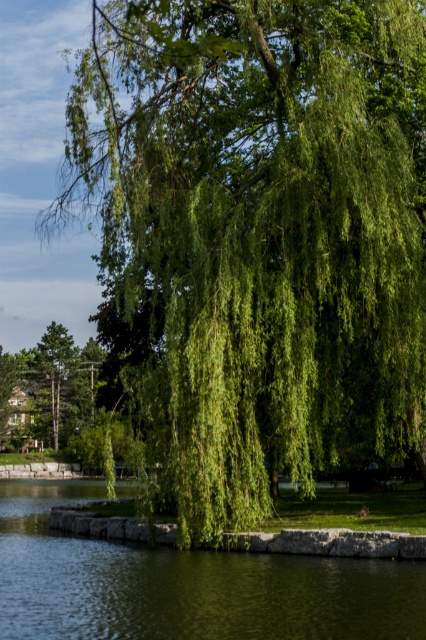
Question: Which of the following is the closest to the observer?

Choices:
 (A) green leafy tree at lower left
 (B) green liquid water at lower left

Answer: (B)

Question: Can you confirm if green liquid water at lower left is wider than green leafy tree at lower left?

Choices:
 (A) yes
 (B) no

Answer: (A)

Question: Among these objects, which one is nearest to the camera?

Choices:
 (A) green liquid water at lower left
 (B) green leafy tree at lower left

Answer: (A)

Question: Can you confirm if green liquid water at lower left is positioned below green leafy tree at lower left?

Choices:
 (A) no
 (B) yes

Answer: (B)

Question: Is the position of green liquid water at lower left less distant than that of green leafy tree at lower left?

Choices:
 (A) yes
 (B) no

Answer: (A)

Question: Which of the following is the closest to the observer?

Choices:
 (A) (55, 540)
 (B) (89, 362)

Answer: (A)